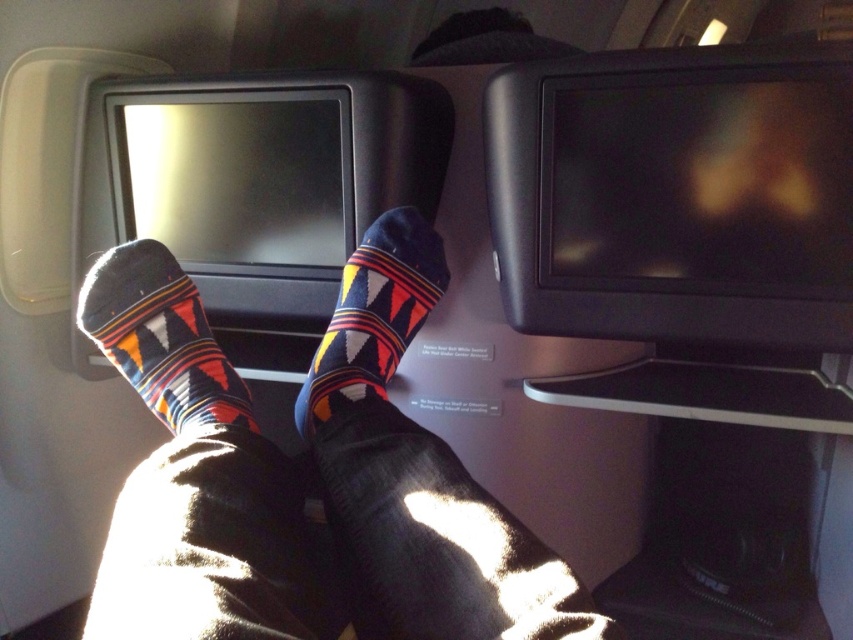
Who is more distant from viewer, (190,289) or (364,369)?

Positioned behind is point (190,289).

Does point (245, 419) lie in front of point (404, 339)?

Yes, point (245, 419) is closer to viewer.

Is point (144, 298) closer to camera compared to point (393, 307)?

Yes, point (144, 298) is closer to viewer.

Find the location of a particular element. Image resolution: width=853 pixels, height=640 pixels. patterned fabric socks at center is located at coordinates (160, 337).

Between knit socks at center and dark blue cotton socks at center, which one has less height?

dark blue cotton socks at center

Find the location of a particular element. This screenshot has width=853, height=640. knit socks at center is located at coordinates (418, 474).

You are a GUI agent. You are given a task and a screenshot of the screen. Output one action in this format:
    pyautogui.click(x=<x>, y=<y>)
    Task: Click on the knit socks at center
    This screenshot has width=853, height=640.
    Given the screenshot: What is the action you would take?
    pyautogui.click(x=418, y=474)

Between point (128, 598) and point (178, 298), which one is positioned behind?

Point (178, 298)

Is knit socks at center closer to the viewer compared to patterned fabric socks at center?

Yes, it is in front of patterned fabric socks at center.

Measure the distance between point (114, 253) and camera.

Point (114, 253) is 29.12 inches from camera.

Identify the location of knit socks at center. (418, 474).